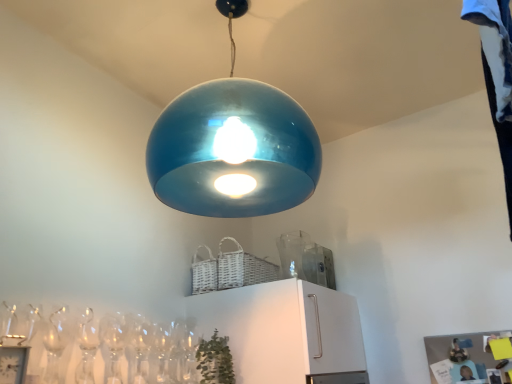
Question: Considering their positions, is glossy blue pendant light at center located in front of or behind transparent glass vase at upper center?

Choices:
 (A) behind
 (B) front

Answer: (B)

Question: From a real-world perspective, relative to transparent glass vase at upper center, is glossy blue pendant light at center vertically above or below?

Choices:
 (A) below
 (B) above

Answer: (B)

Question: Which object is the closest to the green matte plant at lower center?

Choices:
 (A) glossy blue pendant light at center
 (B) transparent glass vase at upper center

Answer: (B)

Question: Which object is the closest to the transparent glass vase at upper center?

Choices:
 (A) green matte plant at lower center
 (B) glossy blue pendant light at center

Answer: (B)